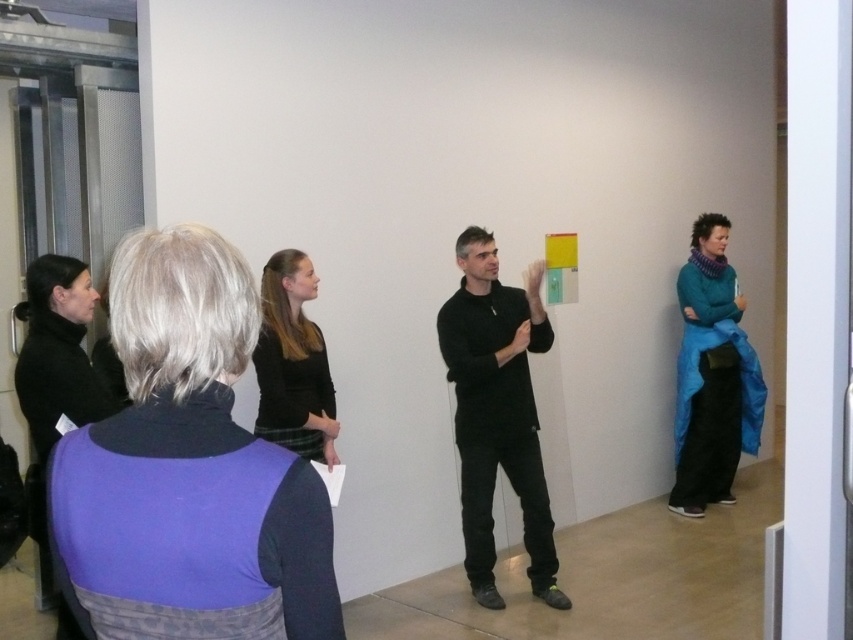
Does purple fabric vest at lower left lie behind blue fabric coat at right?

That is False.

Does point (206, 294) lie behind point (700, 410)?

No, (206, 294) is in front of (700, 410).

The image size is (853, 640). Find the location of `purple fabric vest at lower left`. purple fabric vest at lower left is located at coordinates (187, 468).

Between blue fabric coat at right and black matte jacket at lower left, which one is positioned lower?

black matte jacket at lower left is below.

Who is more forward, (759, 417) or (51, 396)?

Positioned in front is point (51, 396).

Measure the distance between point (759, 412) and camera.

Point (759, 412) and camera are 4.99 meters apart.

The image size is (853, 640). In order to click on blue fabric coat at right in this screenshot , I will do `click(712, 376)`.

Based on the photo, between purple fabric vest at lower left and black matte shirt at center, which one has less height?

purple fabric vest at lower left

The height and width of the screenshot is (640, 853). I want to click on purple fabric vest at lower left, so click(x=187, y=468).

Who is more forward, [128,612] or [494,336]?

Point [128,612]

At what (x,y) coordinates should I click in order to perform the action: click on purple fabric vest at lower left. Please return your answer as a coordinate pair (x, y). Looking at the image, I should click on (187, 468).